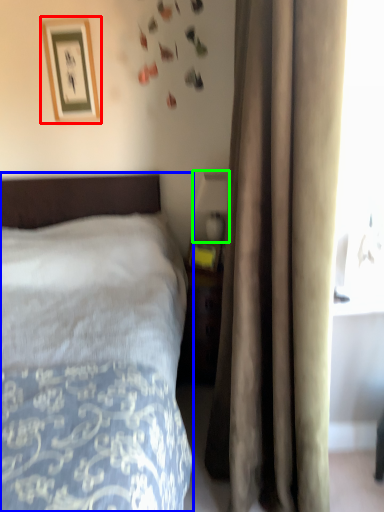
Question: Which object is the closest to the picture frame (highlighted by a red box)? Choose among these: bed (highlighted by a blue box) or table lamp (highlighted by a green box).

Choices:
 (A) bed
 (B) table lamp

Answer: (B)